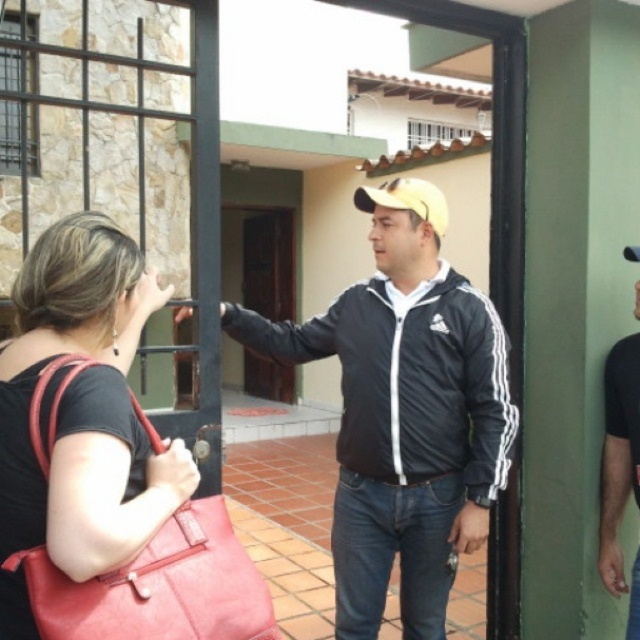
You are standing at the origin point in the image. There is a black matte jacket at center represented by point [404,422]. Can you tell me the direction of the black matte jacket at center from your current position?

The black matte jacket at center is located at point [404,422], which is the center of the image. Therefore, the direction from the origin point would be directly ahead or center.

You are a delivery person trying to enter the house through the brown wooden door at center. The black matte jacket at center is blocking your path. Can you get through without moving the jacket?

The black matte jacket at center is wider than the brown wooden door at center, so it would block the doorway completely. You cannot pass through without moving the jacket.